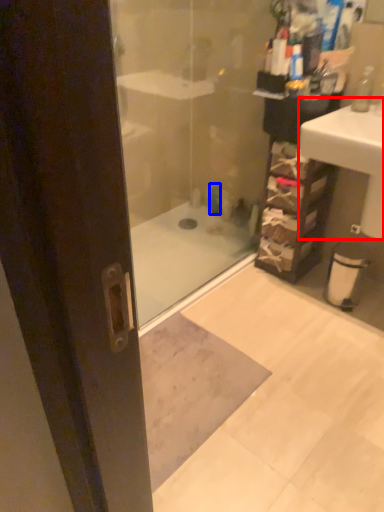
Question: Which point is closer to the camera, sink (highlighted by a red box) or toiletry (highlighted by a blue box)?

Choices:
 (A) sink
 (B) toiletry

Answer: (A)